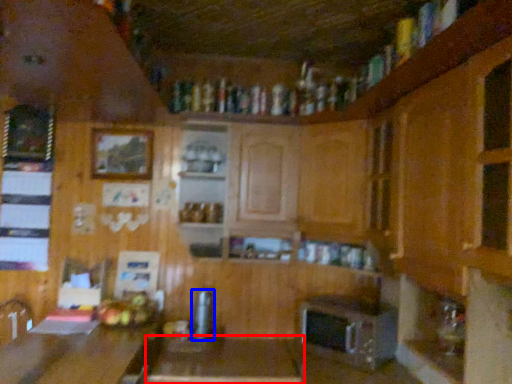
Question: Which object is further to the camera taking this photo, table (highlighted by a red box) or appliance (highlighted by a blue box)?

Choices:
 (A) table
 (B) appliance

Answer: (B)